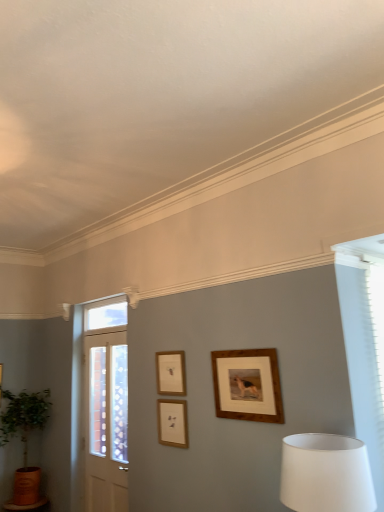
Question: Considering the positions of point (119, 313) and point (87, 352), is point (119, 313) closer or farther from the camera than point (87, 352)?

Choices:
 (A) farther
 (B) closer

Answer: (B)

Question: Considering their positions, is clear glass window at upper center located in front of or behind white wood door at left?

Choices:
 (A) behind
 (B) front

Answer: (A)

Question: Estimate the real-world distances between objects in this image. Which object is closer to the wooden picture frame at center, the 1th picture frame viewed from the right?

Choices:
 (A) green leafy plant in terracotta pot at lower left
 (B) clear glass window at upper center
 (C) white fabric lampshade at lower right
 (D) wooden picture frame at center, the second picture frame viewed from the left
 (E) wooden picture frame at upper center, positioned as the 3th picture frame in right-to-left order

Answer: (E)

Question: Which of these objects is positioned farthest from the wooden picture frame at center, the 2th picture frame viewed from the right?

Choices:
 (A) green leafy plant in terracotta pot at lower left
 (B) wooden picture frame at upper center, which ranks as the 1th picture frame in left-to-right order
 (C) white wood door at left
 (D) white fabric lampshade at lower right
 (E) clear glass window at upper center

Answer: (A)